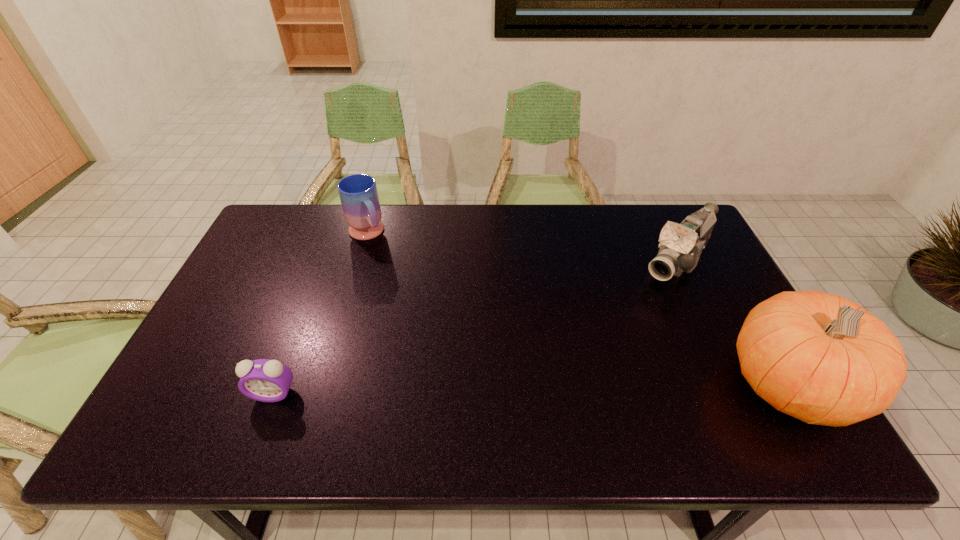
Where is `vacant spot on the desktop that is between the alarm clock and the pumpkin and is positioned on the side of the mug with the handle`? Image resolution: width=960 pixels, height=540 pixels. vacant spot on the desktop that is between the alarm clock and the pumpkin and is positioned on the side of the mug with the handle is located at coordinates (481, 390).

Locate an element on the screen. This screenshot has height=540, width=960. free space on the desktop that is between the alarm clock and the tallest object and is positioned on the front-facing side of the camcorder is located at coordinates (560, 389).